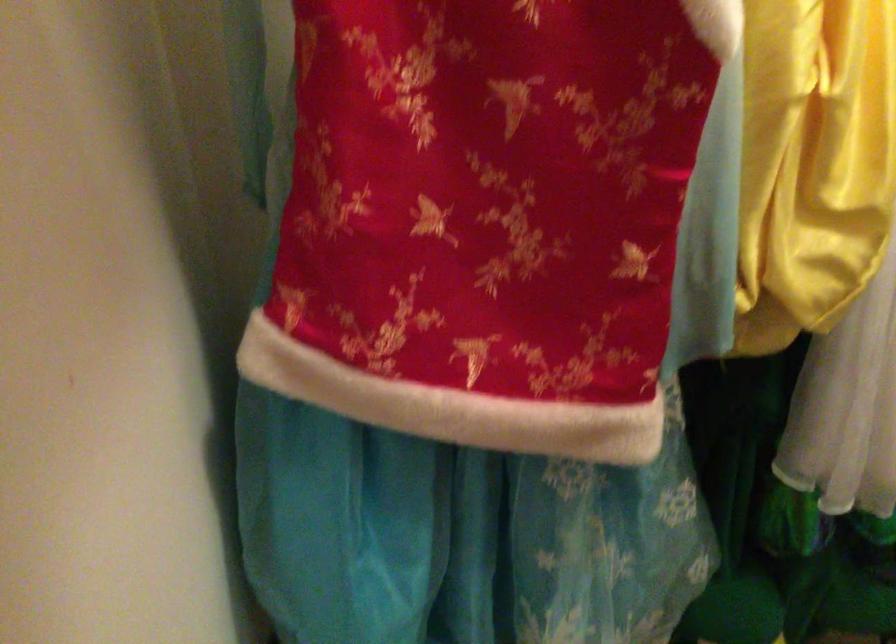
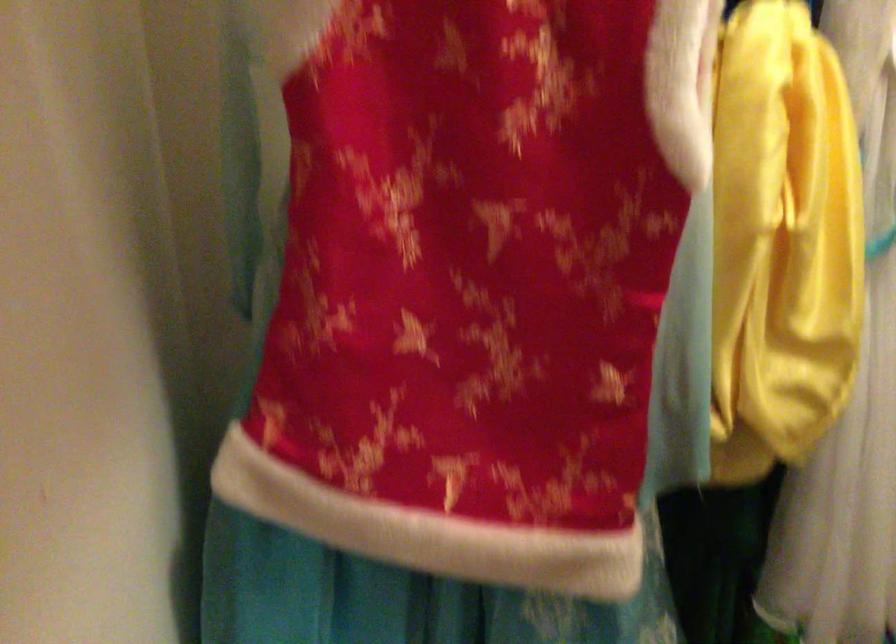
Question: Based on the continuous images, in which direction is the camera rotating? Reply with the corresponding letter.

Choices:
 (A) Left
 (B) Right
 (C) Up
 (D) Down

Answer: (C)